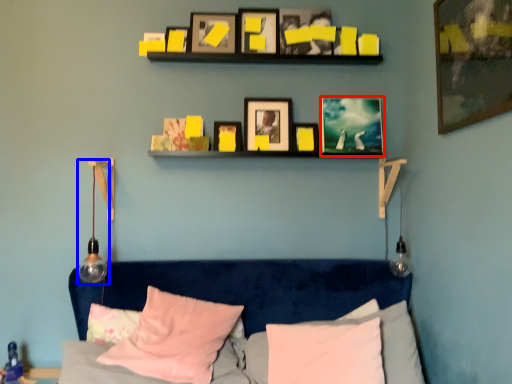
Question: Which of the following is the farthest to the observer, picture frame (highlighted by a red box) or lamp (highlighted by a blue box)?

Choices:
 (A) picture frame
 (B) lamp

Answer: (A)